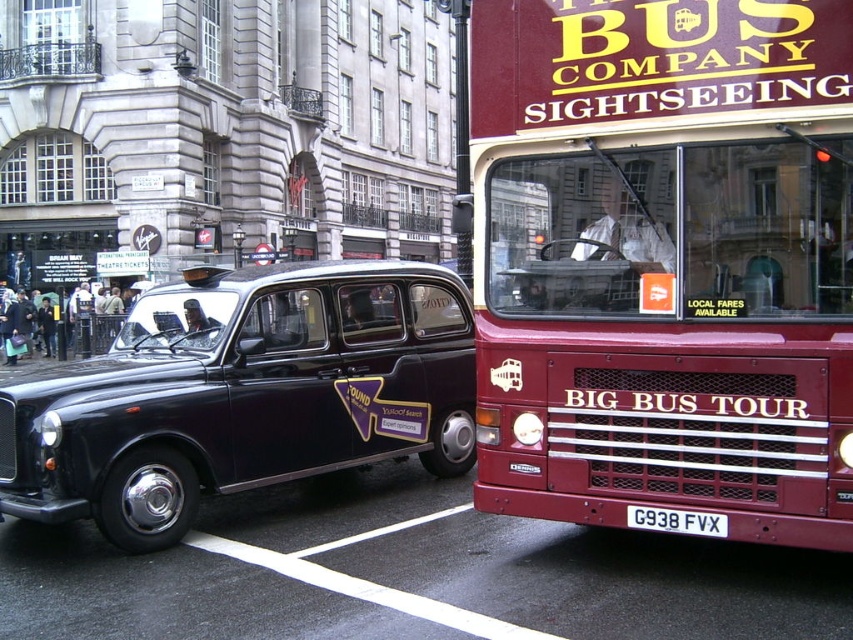
From the picture: You are standing at the point marked by the coordinates (664, 260) in the image. What object are you directly in front of?

The point marked by the coordinates (664, 260) is directly in front of the maroon metallic bus at center.

You are a pedestrian standing on the sidewalk and want to take a photo of the shiny black taxi at center and the white plastic license plate at center. If your camera can only focus on objects within 10 feet, will you be able to capture both clearly in one shot?

The distance between the shiny black taxi at center and the white plastic license plate at center is 12.47 feet, which exceeds the camera focus range of 10 feet. Therefore, you cannot capture both clearly in one shot.